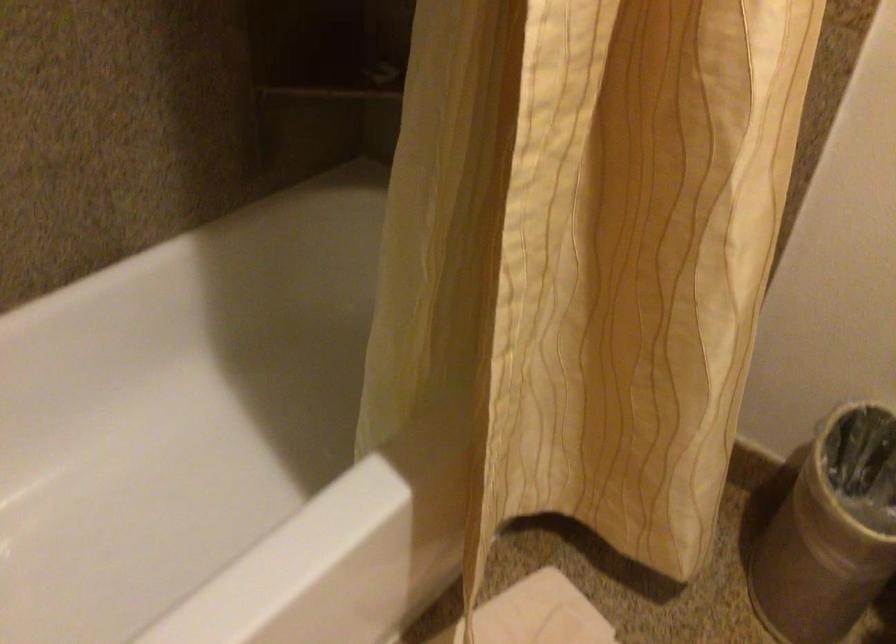
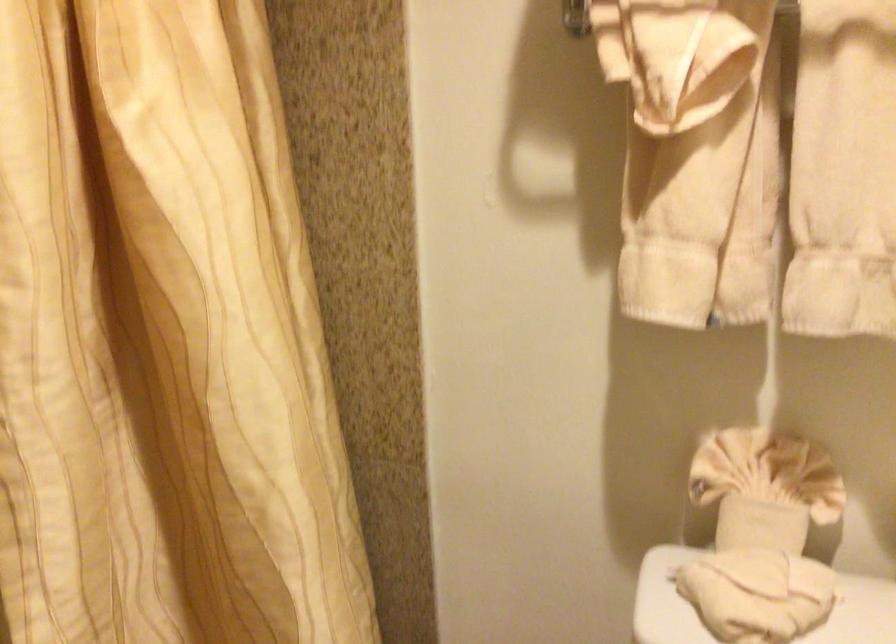
The images are taken continuously from a first-person perspective. In which direction are you moving?

The movement direction of the cameraman is right, backward.